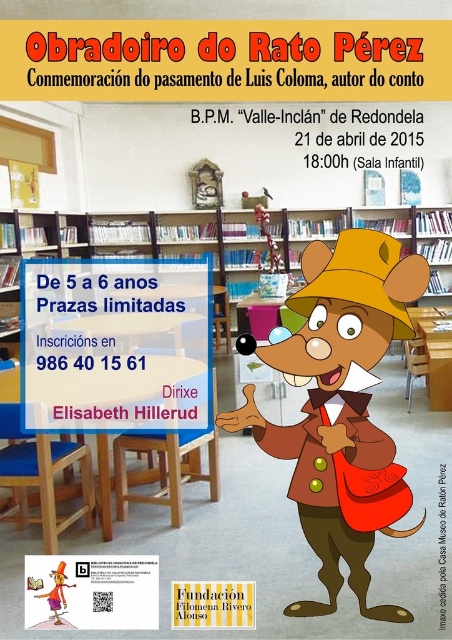
Question: Where is brown fabric mouse at center located in relation to wooden bookshelf at center in the image?

Choices:
 (A) left
 (B) right

Answer: (B)

Question: Among these points, which one is farthest from the camera?

Choices:
 (A) (39, 595)
 (B) (178, 220)
 (C) (400, 278)

Answer: (B)

Question: Is wooden bookshelf at center positioned before matte yellow hat at upper center?

Choices:
 (A) yes
 (B) no

Answer: (B)

Question: Which point is closer to the camera?

Choices:
 (A) (50, 602)
 (B) (97, 214)

Answer: (A)

Question: Is brown fabric mouse at center above wooden bookshelf at center?

Choices:
 (A) yes
 (B) no

Answer: (B)

Question: Which of the following is the closest to the observer?

Choices:
 (A) (312, 513)
 (B) (37, 241)

Answer: (A)